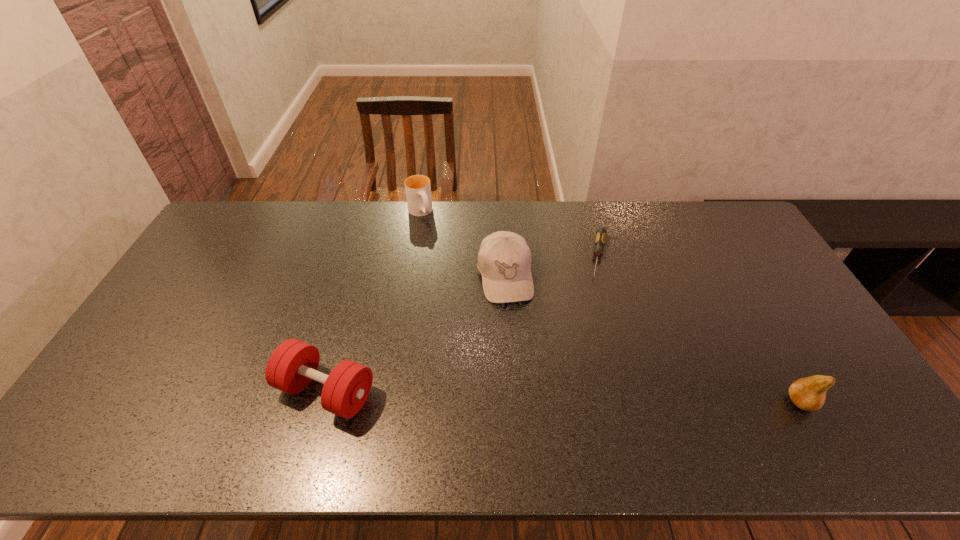
You are a GUI agent. You are given a task and a screenshot of the screen. Output one action in this format:
    pyautogui.click(x=<x>, y=<y>)
    Task: Click on the dumbbell
    This screenshot has width=960, height=540.
    Given the screenshot: What is the action you would take?
    pyautogui.click(x=293, y=364)

The image size is (960, 540). What are the coordinates of `the rightmost object` in the screenshot? It's located at (809, 393).

Identify the location of baseball cap. (504, 260).

Where is `cup`? The image size is (960, 540). cup is located at coordinates (418, 189).

Identify the location of the second object from right to left. (600, 239).

The width and height of the screenshot is (960, 540). What are the coordinates of `screwdriver` in the screenshot? It's located at (600, 239).

Image resolution: width=960 pixels, height=540 pixels. What are the coordinates of `vacant space situated on the right of the dumbbell` in the screenshot? It's located at (519, 391).

Locate an element on the screen. This screenshot has height=540, width=960. free space located 0.220m on the back of the rightmost object is located at coordinates (756, 322).

Locate an element on the screen. This screenshot has width=960, height=540. vacant space located 0.340m on the front-facing side of the third object from left to right is located at coordinates (530, 409).

I want to click on vacant region located on the front-facing side of the third object from left to right, so tap(516, 336).